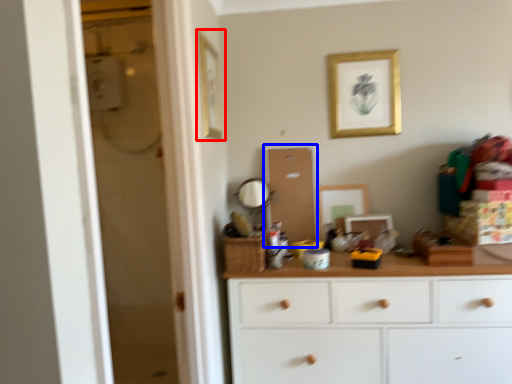
Question: Which point is further to the camera, picture frame (highlighted by a red box) or screen door (highlighted by a blue box)?

Choices:
 (A) picture frame
 (B) screen door

Answer: (B)